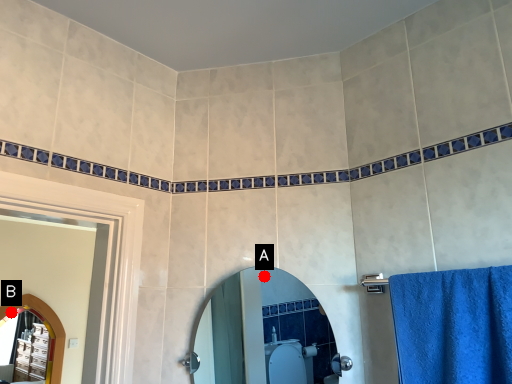
Question: Two points are circled on the image, labeled by A and B beside each circle. Which point is farther to the camera?

Choices:
 (A) A is further
 (B) B is further

Answer: (B)